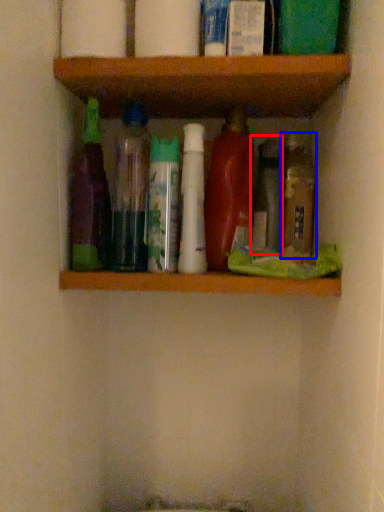
Question: Among these objects, which one is farthest to the camera, bottle (highlighted by a red box) or bottle (highlighted by a blue box)?

Choices:
 (A) bottle
 (B) bottle

Answer: (A)